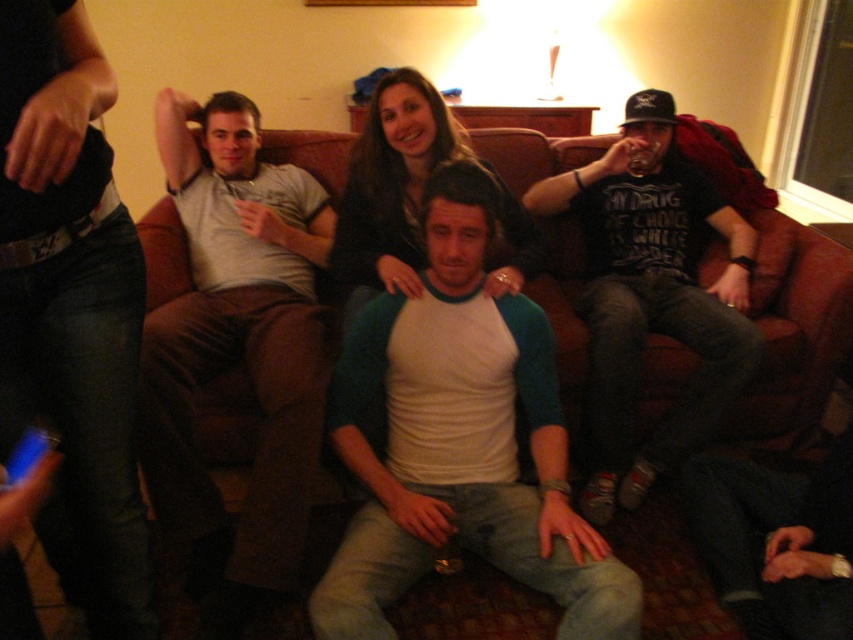
Which of these two, gray cotton shirt at left or dark gray t-shirt at right, stands shorter?

Standing shorter between the two is gray cotton shirt at left.

Is point (270, 470) positioned in front of point (596, 202)?

Yes, point (270, 470) is closer to viewer.

The width and height of the screenshot is (853, 640). Identify the location of gray cotton shirt at left. (236, 333).

Can you confirm if white jersey at center is positioned to the left of brown leather couch at center?

Correct, you'll find white jersey at center to the left of brown leather couch at center.

Does white jersey at center have a greater height compared to brown leather couch at center?

No, white jersey at center is not taller than brown leather couch at center.

Who is more forward, (604,561) or (795,371)?

Positioned in front is point (604,561).

Where is `white jersey at center`? This screenshot has width=853, height=640. white jersey at center is located at coordinates (460, 440).

Is brown leather couch at center smaller than dark gray t-shirt at right?

No.

Who is more distant from viewer, (x=157, y=512) or (x=682, y=288)?

The point (x=682, y=288) is more distant.

Is point (189, 586) positioned behind point (589, 227)?

No.

The width and height of the screenshot is (853, 640). I want to click on brown leather couch at center, so click(x=792, y=340).